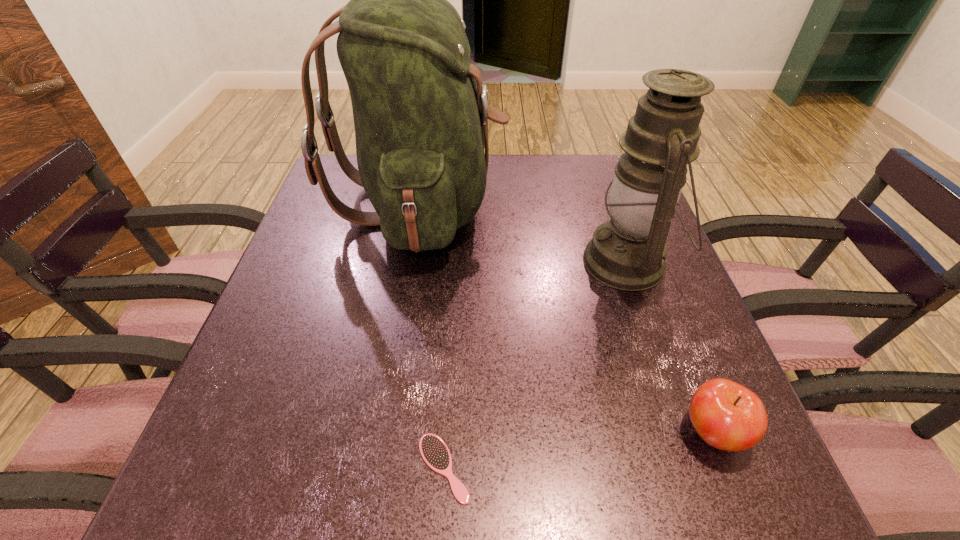
Identify the location of vacant area that lies between the oil lamp and the backpack. The image size is (960, 540). (523, 234).

I want to click on free space between the apple and the shortest object, so (x=579, y=450).

You are a GUI agent. You are given a task and a screenshot of the screen. Output one action in this format:
    pyautogui.click(x=<x>, y=<y>)
    Task: Click on the free space between the backpack and the apple
    
    Given the screenshot: What is the action you would take?
    pyautogui.click(x=566, y=319)

Where is `free area in between the shortest object and the second shortest object`? This screenshot has width=960, height=540. free area in between the shortest object and the second shortest object is located at coordinates [579, 450].

The height and width of the screenshot is (540, 960). Identify the location of unoccupied area between the backpack and the third tallest object. (566, 319).

This screenshot has height=540, width=960. I want to click on free space that is in between the apple and the second tallest object, so click(671, 347).

Locate an element on the screen. free point between the oil lamp and the third tallest object is located at coordinates [x=671, y=347].

At what (x,y) coordinates should I click in order to perform the action: click on free point between the third tallest object and the shortest object. Please return your answer as a coordinate pair (x, y). Looking at the image, I should click on (579, 450).

Identify the location of vacant space in between the oil lamp and the backpack. The image size is (960, 540). (523, 234).

Identify the location of free space that is in between the backpack and the apple. Image resolution: width=960 pixels, height=540 pixels. (566, 319).